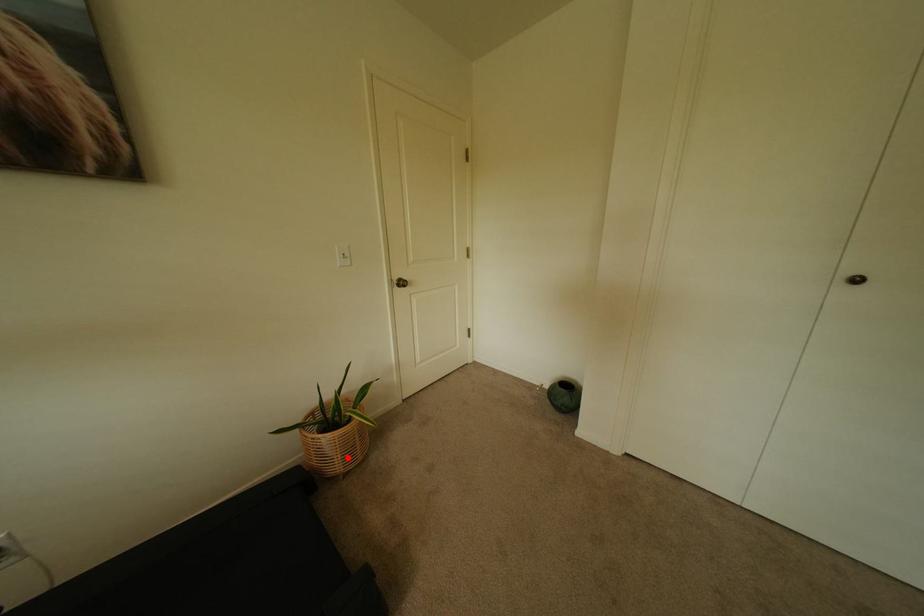
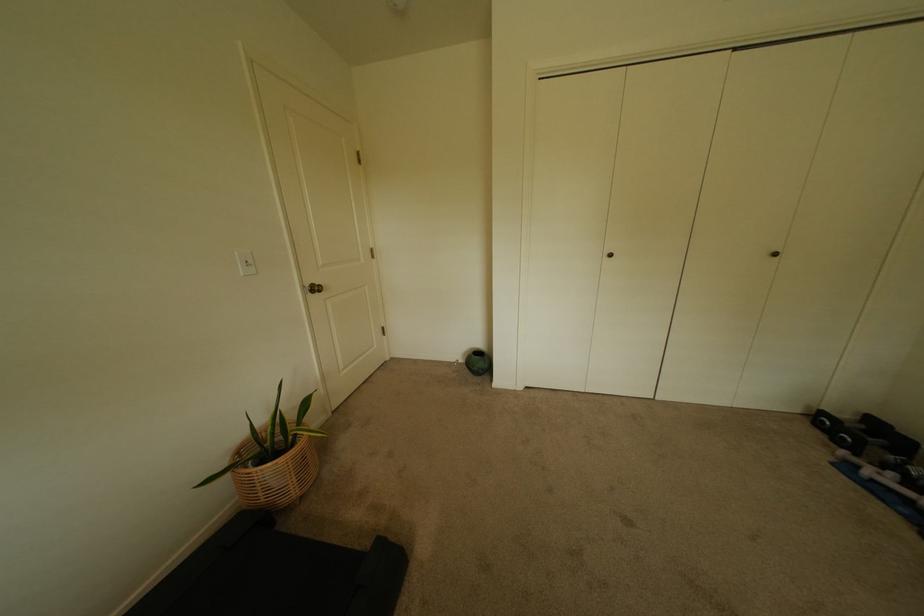
Question: A red point is marked in image1. In image2, is the corresponding 3D point closer to the camera or farther? Reply with the corresponding letter.

Choices:
 (A) The corresponding 3D point is closer.
 (B) The corresponding 3D point is farther.

Answer: (A)